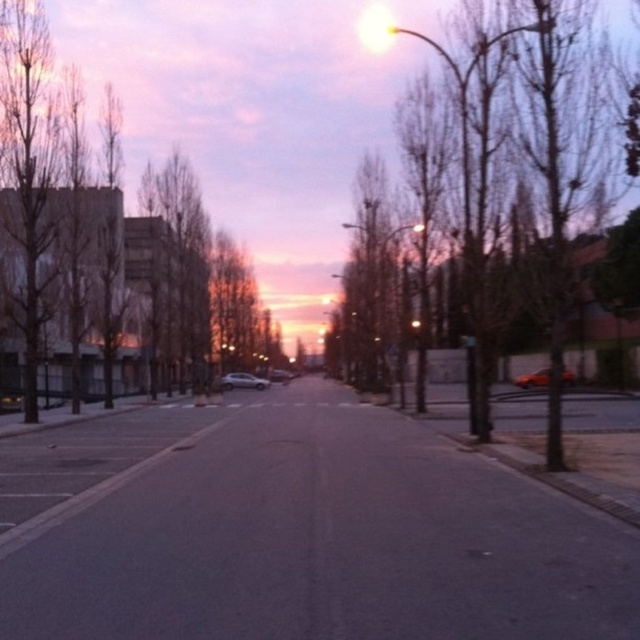
Question: Which point is farther from the camera taking this photo?

Choices:
 (A) (289, 378)
 (B) (572, 381)
 (C) (240, 381)

Answer: (A)

Question: Which point is farther from the camera taking this photo?

Choices:
 (A) (264, 385)
 (B) (595, 56)
 (C) (547, 384)

Answer: (A)

Question: Can you confirm if bare branches at center is thinner than satin silver car at center?

Choices:
 (A) yes
 (B) no

Answer: (B)

Question: Does brown leafless tree at left appear under satin silver sedan at center?

Choices:
 (A) yes
 (B) no

Answer: (B)

Question: Is metallic orange car at center wider than satin silver sedan at center?

Choices:
 (A) no
 (B) yes

Answer: (B)

Question: Which point is closer to the camera?

Choices:
 (A) satin silver car at center
 (B) satin silver sedan at center
 (C) bare branches at center
 (D) metallic orange car at center

Answer: (C)